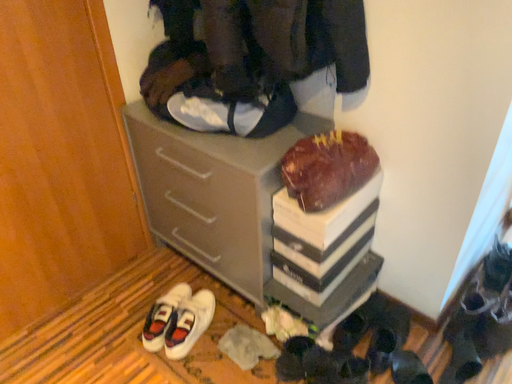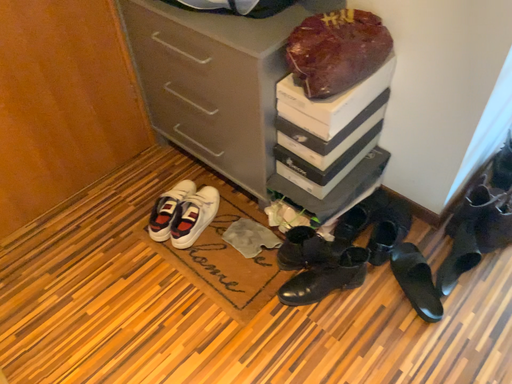
Question: How did the camera likely rotate when shooting the video?

Choices:
 (A) rotated downward
 (B) rotated upward

Answer: (A)